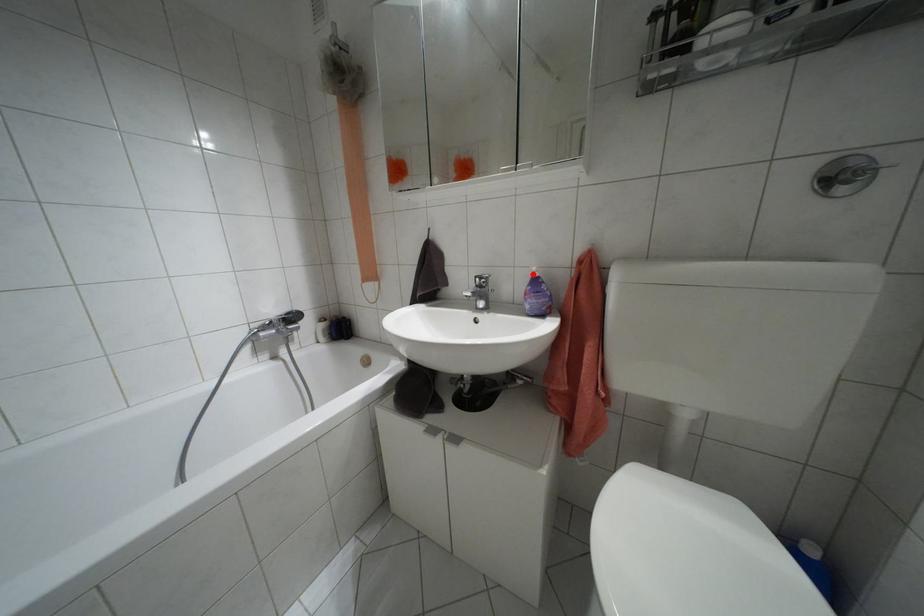
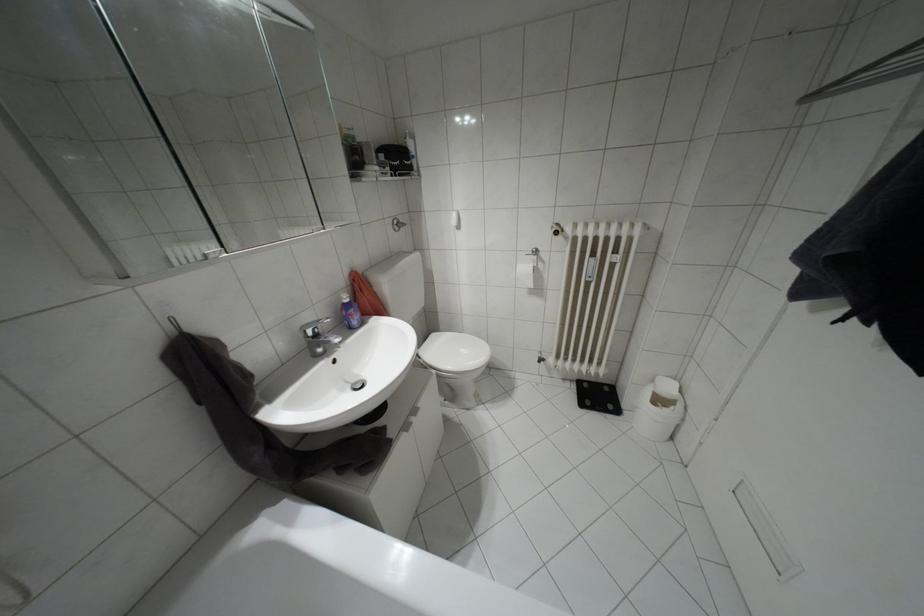
Locate, in the second image, the point that corresponds to the highlighted location in the first image.

(346, 300)